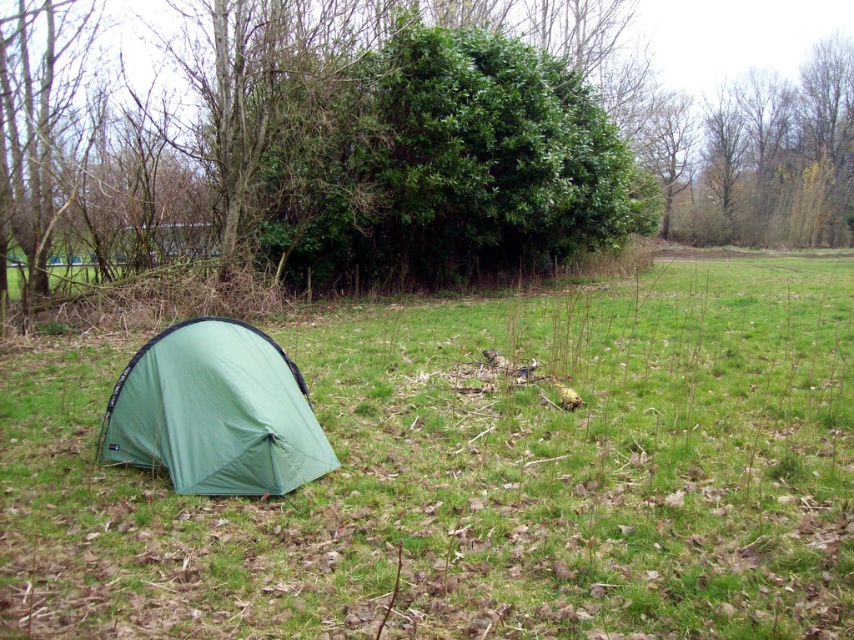
Measure the distance from green fabric tent at left to green leafy bush at center.

A distance of 40.74 feet exists between green fabric tent at left and green leafy bush at center.

Does green fabric tent at left have a greater width compared to green leafy bush at center?

No, green fabric tent at left is not wider than green leafy bush at center.

Does point (645, 392) lie in front of point (313, 156)?

Yes, it is in front of point (313, 156).

Image resolution: width=854 pixels, height=640 pixels. I want to click on green fabric tent at left, so click(477, 476).

Who is positioned more to the right, green leafy bush at center or green nylon tent at lower left?

green leafy bush at center

Is point (237, 35) positioned before point (155, 445)?

No, (237, 35) is behind (155, 445).

The height and width of the screenshot is (640, 854). I want to click on green leafy bush at center, so click(x=395, y=147).

Between green fabric tent at left and green nylon tent at lower left, which one is positioned lower?

green nylon tent at lower left

Is green fabric tent at left in front of green nylon tent at lower left?

Yes, green fabric tent at left is closer to the viewer.

Locate an element on the screen. This screenshot has width=854, height=640. green fabric tent at left is located at coordinates (477, 476).